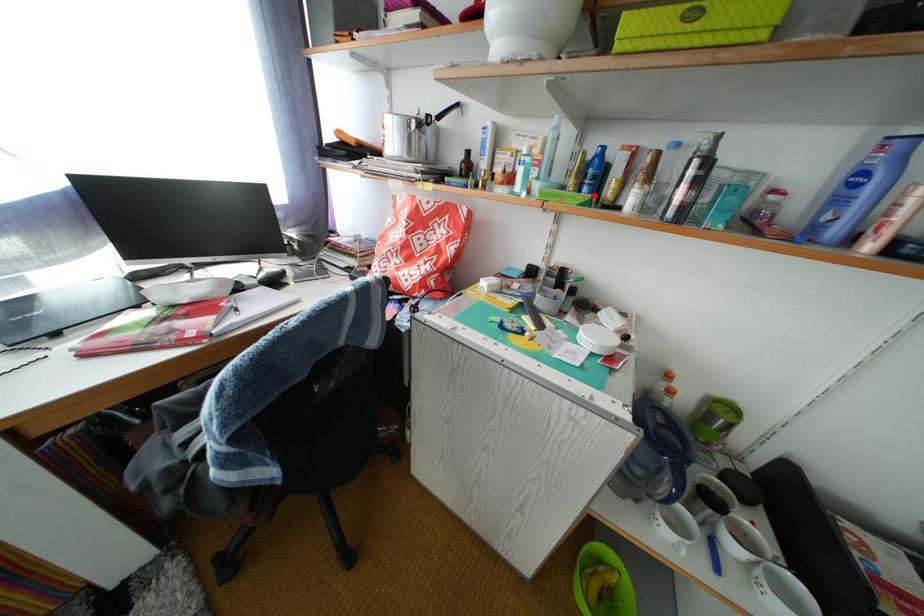
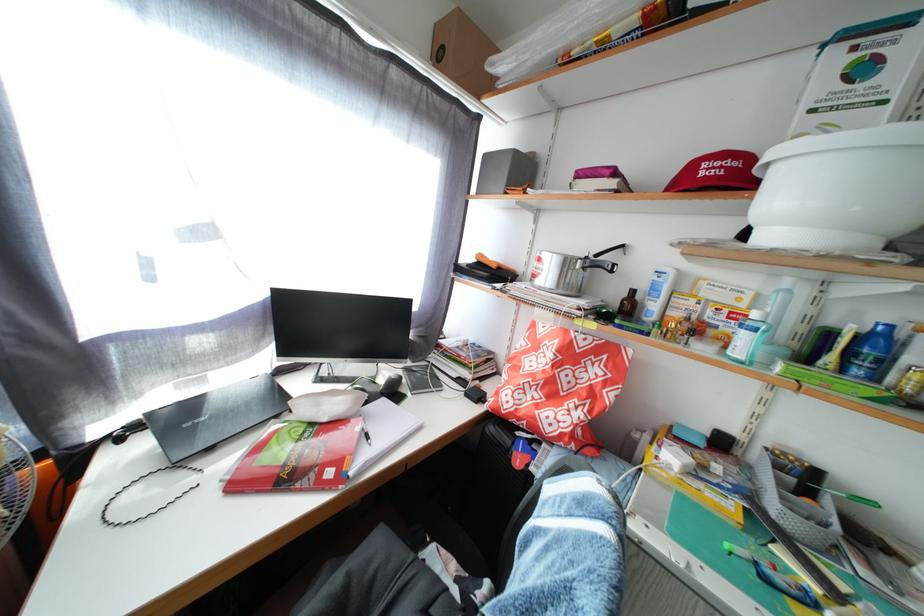
Locate, in the second image, the point that corresponds to the highlighted location in the first image.

(866, 378)